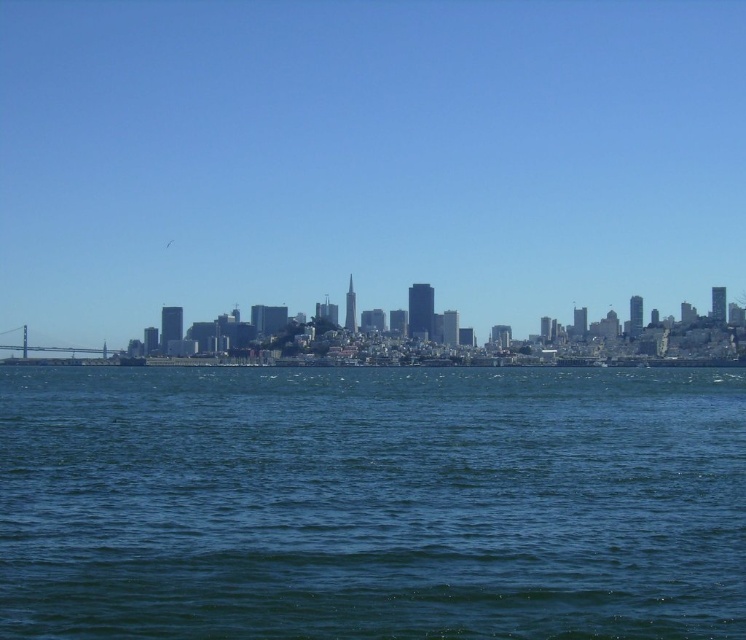
Question: Which object is farther from the camera taking this photo?

Choices:
 (A) blue liquid water at center
 (B) transparent glass skyscrapers at center

Answer: (B)

Question: Is the position of transparent glass skyscrapers at center less distant than that of blue liquid water at center?

Choices:
 (A) yes
 (B) no

Answer: (B)

Question: Which point appears closest to the camera in this image?

Choices:
 (A) (460, 250)
 (B) (65, 492)

Answer: (B)

Question: Which object appears closest to the camera in this image?

Choices:
 (A) transparent glass skyscrapers at center
 (B) blue liquid water at center

Answer: (B)

Question: Is transparent glass skyscrapers at center thinner than blue liquid water at center?

Choices:
 (A) no
 (B) yes

Answer: (A)

Question: Does transparent glass skyscrapers at center appear over blue liquid water at center?

Choices:
 (A) no
 (B) yes

Answer: (B)